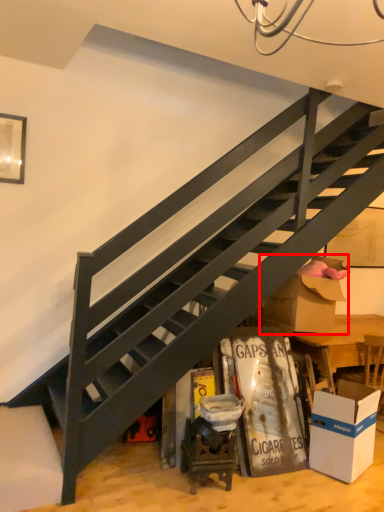
Question: From the image's perspective, considering the relative positions of cardboard box (annotated by the red box) and box in the image provided, where is cardboard box (annotated by the red box) located with respect to the staircase?

Choices:
 (A) above
 (B) below

Answer: (A)